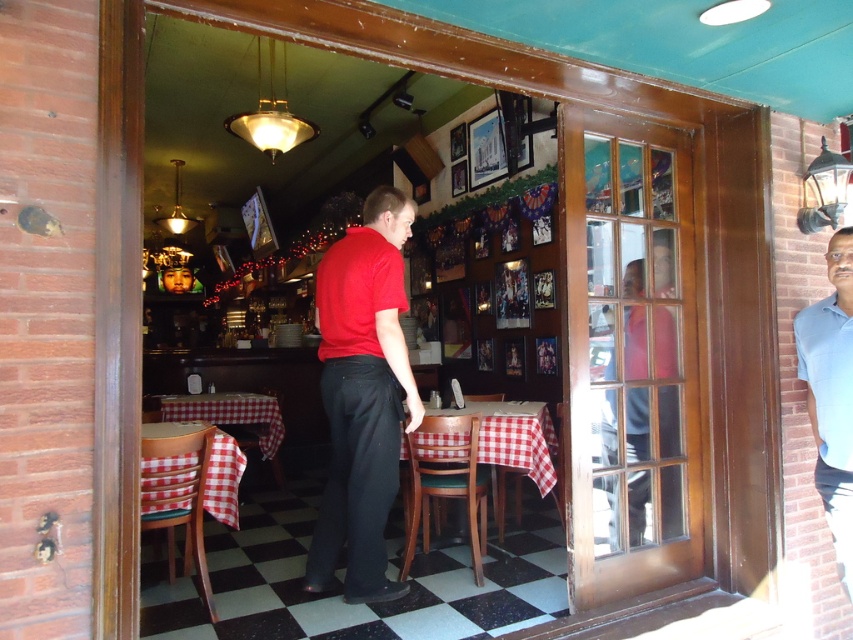
You are a customer entering the diner and see the red matte shirt at center and the checkered fabric table at center. Which object is closer to the entrance?

The red matte shirt at center is closer to the entrance because it is located above the checkered fabric table at center, indicating it is positioned higher and thus nearer to the entrance.

You are a customer entering the diner and see the red matte shirt at center and the checkered fabric table at center. Which object takes up more space in the scene?

The checkered fabric table at center takes up more space than the red matte shirt at center because the red matte shirt at center occupies less space than checkered fabric table at center.

You are a customer entering the diner and see two shirts hanging on a coat rack near the entrance. The red matte shirt at center and the blue cotton shirt at right. Which shirt is positioned higher on the coat rack?

The red matte shirt at center is positioned higher on the coat rack than the blue cotton shirt at right.